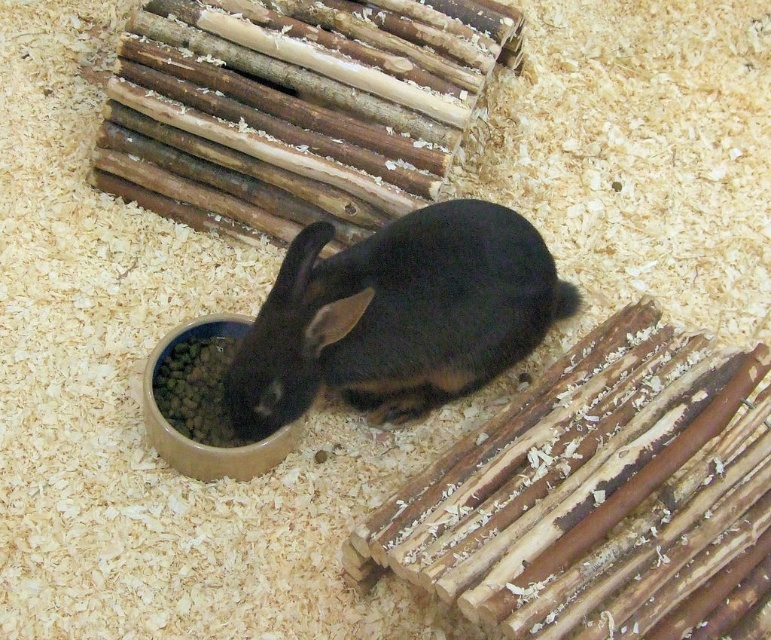
Question: Does black matte rabbit at center appear on the right side of brown matte bowl at lower center?

Choices:
 (A) no
 (B) yes

Answer: (B)

Question: Is black matte rabbit at center in front of brown matte bowl at lower center?

Choices:
 (A) yes
 (B) no

Answer: (A)

Question: Which point is farther to the camera?

Choices:
 (A) (500, 312)
 (B) (244, 476)

Answer: (B)

Question: Does black matte rabbit at center have a smaller size compared to brown matte bowl at lower center?

Choices:
 (A) no
 (B) yes

Answer: (A)